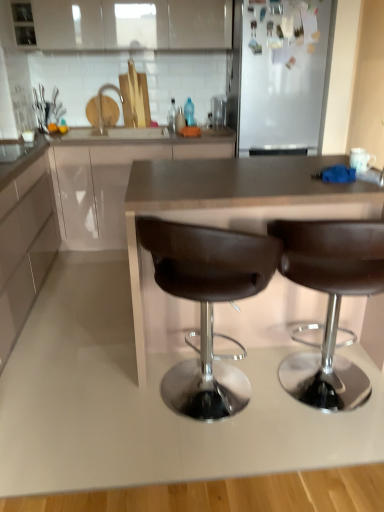
Locate an element on the screen. free point above brown leather countertop at center (from a real-world perspective) is located at coordinates (246, 173).